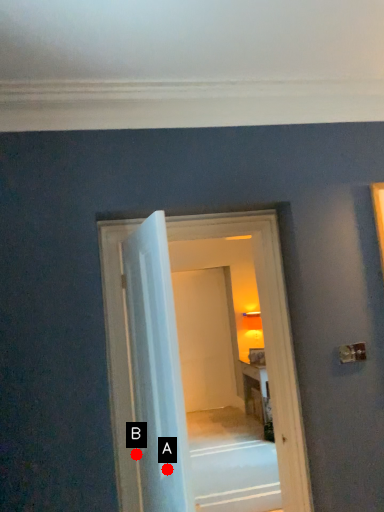
Question: Two points are circled on the image, labeled by A and B beside each circle. Which of the following is the closest to the observer?

Choices:
 (A) A is closer
 (B) B is closer

Answer: (A)